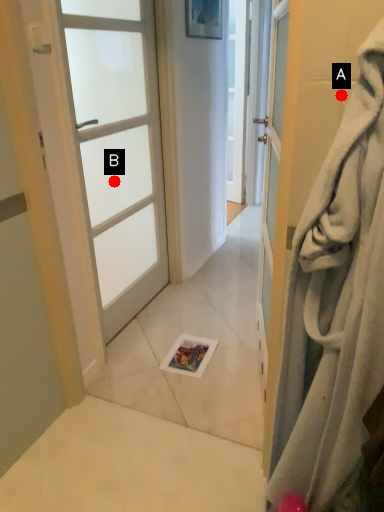
Question: Two points are circled on the image, labeled by A and B beside each circle. Which point is closer to the camera?

Choices:
 (A) A is closer
 (B) B is closer

Answer: (A)